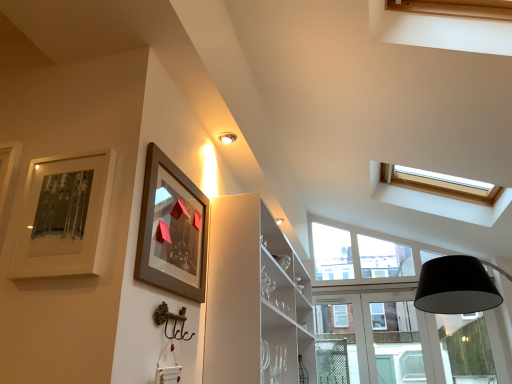
Question: From the image's perspective, is clear glass window at center above or below matte brown picture frame at upper left, acting as the first picture frame starting from the right?

Choices:
 (A) above
 (B) below

Answer: (B)

Question: Based on their positions, is clear glass window at center located to the left or right of matte brown picture frame at upper left, which appears as the second picture frame when viewed from the left?

Choices:
 (A) right
 (B) left

Answer: (A)

Question: Which object is positioned farthest from the clear glass window at center?

Choices:
 (A) matte brown picture frame at upper left, acting as the first picture frame starting from the right
 (B) matte silver picture frame at upper left, which appears as the 2th picture frame when viewed from the right

Answer: (B)

Question: Considering the real-world distances, which object is closest to the matte brown picture frame at upper left, which appears as the second picture frame when viewed from the left?

Choices:
 (A) clear glass window at center
 (B) matte silver picture frame at upper left, which appears as the 2th picture frame when viewed from the right

Answer: (B)